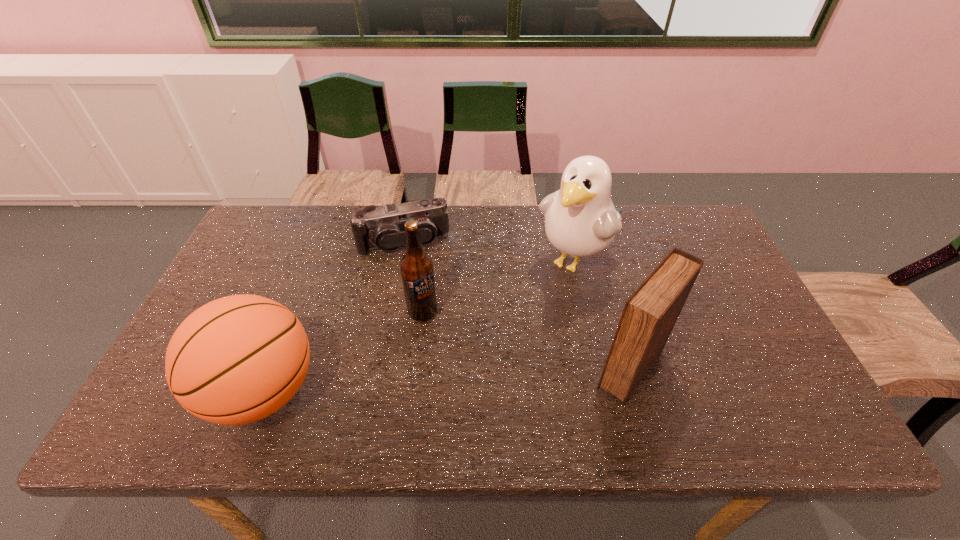
Where is `basketball`? The height and width of the screenshot is (540, 960). basketball is located at coordinates (238, 359).

What are the coordinates of `Bible` in the screenshot? It's located at (650, 313).

Where is `the shortest object`? This screenshot has height=540, width=960. the shortest object is located at coordinates (383, 228).

You are a GUI agent. You are given a task and a screenshot of the screen. Output one action in this format:
    pyautogui.click(x=<x>, y=<y>)
    Task: Click on the gull
    This screenshot has width=960, height=540.
    Given the screenshot: What is the action you would take?
    pyautogui.click(x=580, y=219)

Where is `the third farthest object`? the third farthest object is located at coordinates (416, 267).

Locate an element on the screen. free space located 0.320m on the back of the basketball is located at coordinates (315, 259).

What are the coordinates of `free region located on the left of the Bible` in the screenshot? It's located at (525, 369).

Where is `free space located 0.220m on the front-facing side of the camcorder`? free space located 0.220m on the front-facing side of the camcorder is located at coordinates (426, 311).

Identify the location of vacant area located on the front-facing side of the camcorder. This screenshot has height=540, width=960. (420, 282).

You are a GUI agent. You are given a task and a screenshot of the screen. Output one action in this format:
    pyautogui.click(x=<x>, y=<y>)
    Task: Click on the free space located 0.190m on the front-facing side of the camcorder
    
    Given the screenshot: What is the action you would take?
    pyautogui.click(x=424, y=303)